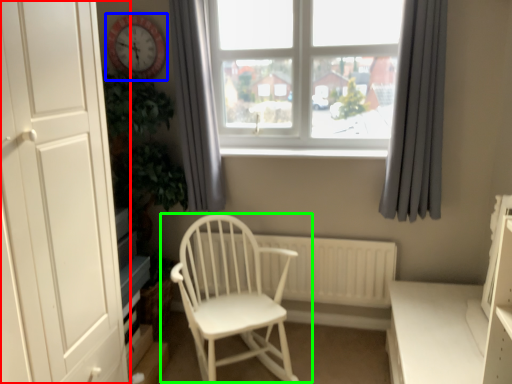
Question: Considering the real-world distances, which object is farthest from door (highlighted by a red box)? clock (highlighted by a blue box) or chair (highlighted by a green box)?

Choices:
 (A) clock
 (B) chair

Answer: (A)